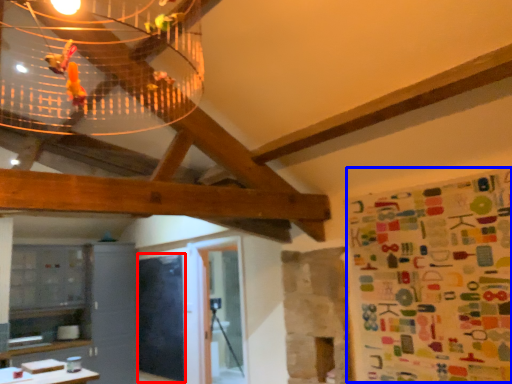
Question: Which object appears farthest to the camera in this image, bulletin board (highlighted by a red box) or wrapping paper (highlighted by a blue box)?

Choices:
 (A) bulletin board
 (B) wrapping paper

Answer: (A)